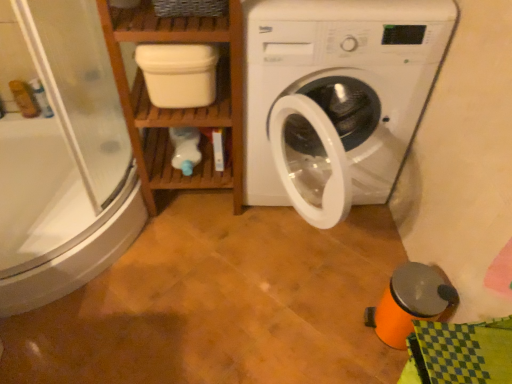
Measure the distance between point (190, 93) and camera.

The distance of point (190, 93) from camera is 4.41 feet.

Describe the element at coordinates (62, 158) in the screenshot. I see `transparent glass shower door at left` at that location.

Describe the element at coordinates (336, 97) in the screenshot. I see `white plastic washing machine at center` at that location.

What is the approximate height of white plastic washing machine at center?

white plastic washing machine at center is 33.32 inches in height.

Locate an element on the screen. white matte container at upper center is located at coordinates (179, 74).

Does point (162, 88) come behind point (58, 270)?

No, (162, 88) is closer to viewer.

Is white matte container at upper center next to transparent glass shower door at left and touching it?

They are not placed beside each other.

Is white matte container at upper center at the left side of transparent glass shower door at left?

No.

Is white matte container at upper center positioned beyond the bounds of transparent glass shower door at left?

Indeed, white matte container at upper center is completely outside transparent glass shower door at left.

Which object is thinner, white plastic washing machine at center or wooden shelf at left?

wooden shelf at left.

Is there a large distance between white plastic washing machine at center and wooden shelf at left?

No, white plastic washing machine at center is not far from wooden shelf at left.

From the image's perspective, is white plastic washing machine at center on wooden shelf at left?

Actually, white plastic washing machine at center appears below wooden shelf at left in the image.

Considering the positions of point (274, 87) and point (222, 114), is point (274, 87) closer or farther from the camera than point (222, 114)?

Point (274, 87) is closer to the camera than point (222, 114).

Considering the positions of objects wooden shelf at left and transparent glass shower door at left in the image provided, who is behind, wooden shelf at left or transparent glass shower door at left?

wooden shelf at left is more distant.

Between point (194, 23) and point (33, 226), which one is positioned in front?

The point (194, 23) is more forward.

Which of these two, wooden shelf at left or transparent glass shower door at left, stands shorter?

transparent glass shower door at left.

Could you tell me if wooden shelf at left is facing transparent glass shower door at left?

No, wooden shelf at left is not oriented towards transparent glass shower door at left.

Is white matte container at upper center positioned far away from wooden shelf at left?

Actually, white matte container at upper center and wooden shelf at left are a little close together.

Is point (176, 84) closer or farther from the camera than point (133, 135)?

Point (176, 84) is positioned closer to the camera compared to point (133, 135).

Can you confirm if white matte container at upper center is thinner than wooden shelf at left?

Correct, the width of white matte container at upper center is less than that of wooden shelf at left.

Based on the photo, can you tell me how much white matte container at upper center and wooden shelf at left differ in facing direction?

white matte container at upper center and wooden shelf at left are facing 7.82e-05 degrees away from each other.

Considering the sizes of objects white plastic washing machine at center and white matte container at upper center in the image provided, who is shorter, white plastic washing machine at center or white matte container at upper center?

With less height is white matte container at upper center.

Measure the distance from white plastic washing machine at center to white matte container at upper center.

white plastic washing machine at center is 15.54 inches from white matte container at upper center.

Is white plastic washing machine at center not inside white matte container at upper center?

That's correct, white plastic washing machine at center is outside of white matte container at upper center.

Considering the positions of points (125, 40) and (356, 23), is point (125, 40) farther from camera compared to point (356, 23)?

No, it is in front of (356, 23).

Is wooden shelf at left in contact with white plastic washing machine at center?

No.

Could you tell me if wooden shelf at left is facing white plastic washing machine at center?

No, wooden shelf at left is not oriented towards white plastic washing machine at center.

Are white plastic washing machine at center and transparent glass shower door at left making contact?

No, white plastic washing machine at center is not beside transparent glass shower door at left.

Is white plastic washing machine at center bigger than transparent glass shower door at left?

Indeed, white plastic washing machine at center has a larger size compared to transparent glass shower door at left.

Considering the relative sizes of white plastic washing machine at center and transparent glass shower door at left in the image provided, is white plastic washing machine at center wider than transparent glass shower door at left?

In fact, white plastic washing machine at center might be narrower than transparent glass shower door at left.

How many degrees apart are the facing directions of white plastic washing machine at center and transparent glass shower door at left?

They differ by 0.496 degrees in their facing directions.

At what (x,y) coordinates should I click in order to perform the action: click on shower door located in front of the white matte container at upper center. Please return your answer as a coordinate pair (x, y). Image resolution: width=512 pixels, height=384 pixels. Looking at the image, I should click on (62, 158).

The width and height of the screenshot is (512, 384). In the image, there is a white plastic washing machine at center. What are the coordinates of `shelf above it (from the image's perspective)` in the screenshot? It's located at (179, 110).

When comparing their distances from white plastic washing machine at center, does wooden shelf at left or white matte container at upper center seem further?

white matte container at upper center lies further to white plastic washing machine at center than the other object.

Considering their positions, is white plastic washing machine at center positioned further to transparent glass shower door at left than wooden shelf at left?

Based on the image, white plastic washing machine at center appears to be further to transparent glass shower door at left.

When comparing their distances from white matte container at upper center, does transparent glass shower door at left or wooden shelf at left seem further?

transparent glass shower door at left is further to white matte container at upper center.

In the scene shown: Considering their positions, is transparent glass shower door at left positioned closer to wooden shelf at left than white matte container at upper center?

Among the two, white matte container at upper center is located nearer to wooden shelf at left.

When comparing their distances from wooden shelf at left, does white plastic washing machine at center or white matte container at upper center seem further?

Based on the image, white plastic washing machine at center appears to be further to wooden shelf at left.

From the image, which object appears to be nearer to transparent glass shower door at left, wooden shelf at left or white plastic washing machine at center?

wooden shelf at left is positioned closer to the anchor transparent glass shower door at left.

Looking at the image, which one is located closer to white matte container at upper center, wooden shelf at left or white plastic washing machine at center?

wooden shelf at left.

Consider the image. Based on their spatial positions, is white plastic washing machine at center or transparent glass shower door at left further from white matte container at upper center?

transparent glass shower door at left lies further to white matte container at upper center than the other object.

This screenshot has height=384, width=512. I want to click on dish washer between transparent glass shower door at left and white plastic washing machine at center in the horizontal direction, so click(179, 74).

The width and height of the screenshot is (512, 384). Identify the location of shelf between transparent glass shower door at left and white plastic washing machine at center from left to right. (179, 110).

Where is `dish washer located between wooden shelf at left and white plastic washing machine at center in the left-right direction`? This screenshot has height=384, width=512. dish washer located between wooden shelf at left and white plastic washing machine at center in the left-right direction is located at coordinates coord(179,74).

The height and width of the screenshot is (384, 512). What are the coordinates of `shelf between transparent glass shower door at left and white matte container at upper center from left to right` in the screenshot? It's located at (179, 110).